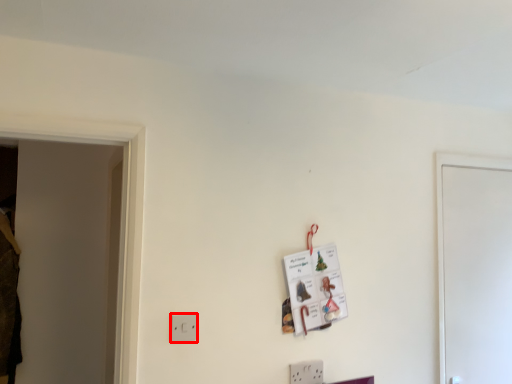
Question: From the image's perspective, where is light switch (annotated by the red box) located relative to door?

Choices:
 (A) above
 (B) below

Answer: (B)